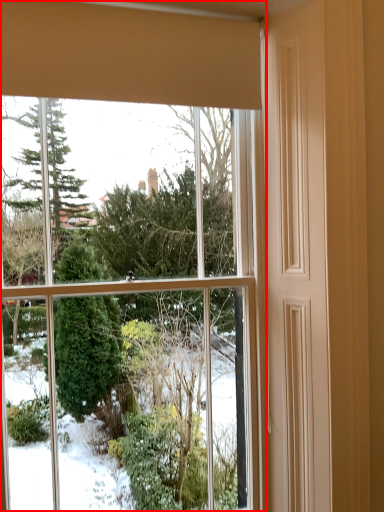
Question: From the image, what is the correct spatial relationship of window (annotated by the red box) in relation to curtain?

Choices:
 (A) left
 (B) right

Answer: (A)